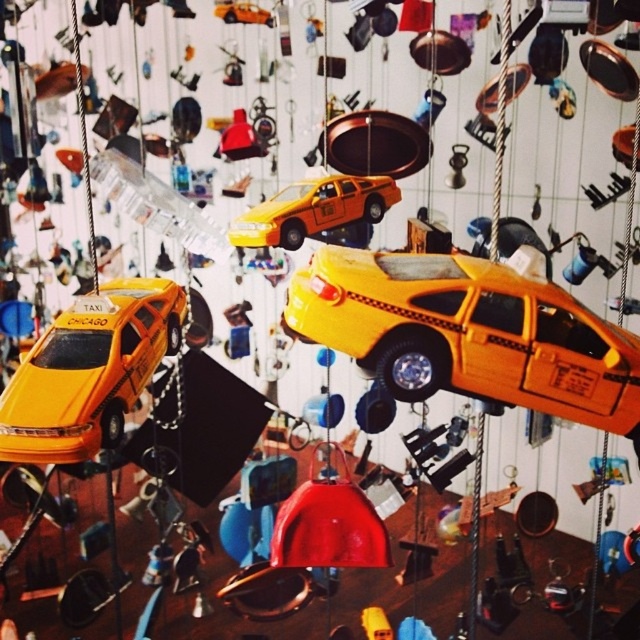
You are standing in front of the wall with hanging objects. There are two points marked on the wall at coordinates point (545, 376) and point (140, 378). Which point is closer to your eyes?

Point (545, 376) is closer to the viewer than point (140, 378).

You are an interior designer planning to hang a new decorative item between the yellow matte taxi at center and the matte yellow toy car at center. Given their sizes, which object should you place the new item closer to to ensure it doesn

The yellow matte taxi at center is wider than the matte yellow toy car at center. To ensure the new decorative item is appropriately spaced, it should be placed closer to the matte yellow toy car at center since it is narrower.